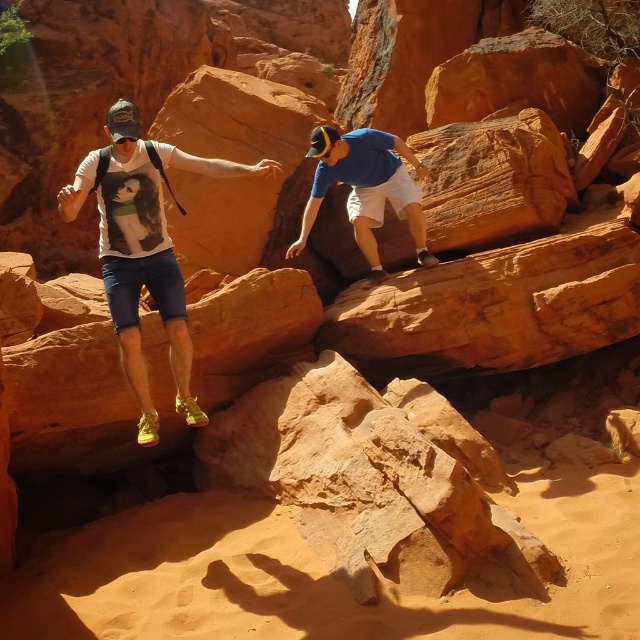
Consider the image. Can you confirm if matte white t-shirt at left is taller than blue cotton shirt at center?

Indeed, matte white t-shirt at left has a greater height compared to blue cotton shirt at center.

Is matte white t-shirt at left further to camera compared to blue cotton shirt at center?

No, matte white t-shirt at left is in front of blue cotton shirt at center.

At what (x,y) coordinates should I click in order to perform the action: click on matte white t-shirt at left. Please return your answer as a coordinate pair (x, y). Looking at the image, I should click on (144, 248).